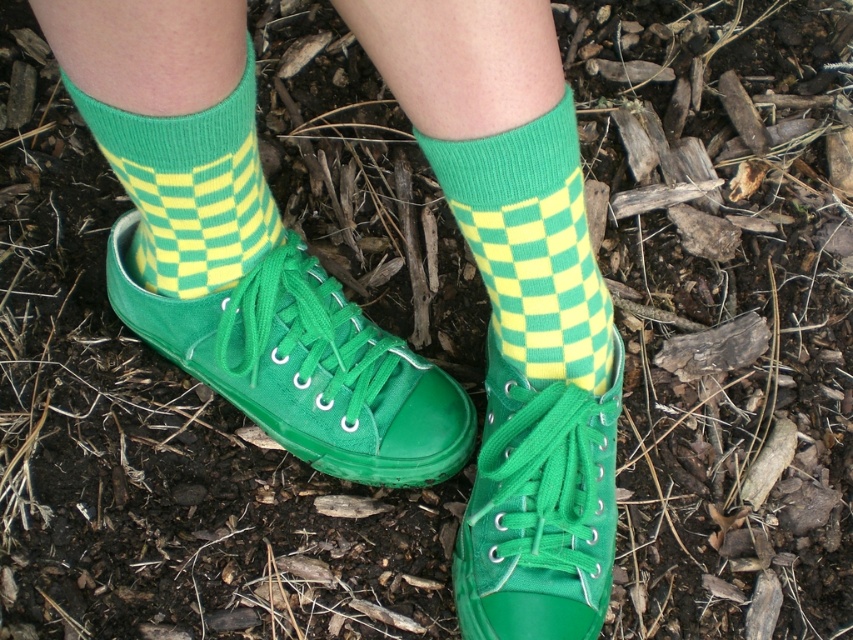
You are a GUI agent. You are given a task and a screenshot of the screen. Output one action in this format:
    pyautogui.click(x=<x>, y=<y>)
    Task: Click on the green rubber shoe at center
    
    Given the screenshot: What is the action you would take?
    pyautogui.click(x=305, y=365)

Who is positioned more to the right, green rubber shoe at center or green canvas shoe at center?

green canvas shoe at center

The height and width of the screenshot is (640, 853). Describe the element at coordinates (305, 365) in the screenshot. I see `green rubber shoe at center` at that location.

The image size is (853, 640). In order to click on green rubber shoe at center in this screenshot , I will do `click(305, 365)`.

Is green checkered sock at center above green knitted sock at center?

No, green checkered sock at center is not above green knitted sock at center.

Is point (572, 362) positioned before point (167, 225)?

That is False.

In order to click on green checkered sock at center in this screenshot , I will do `click(532, 246)`.

From the picture: Is green canvas shoe at center bigger than green knitted sock at center?

No.

Is green canvas shoe at center thinner than green knitted sock at center?

In fact, green canvas shoe at center might be wider than green knitted sock at center.

Where is `green canvas shoe at center`? green canvas shoe at center is located at coordinates (538, 508).